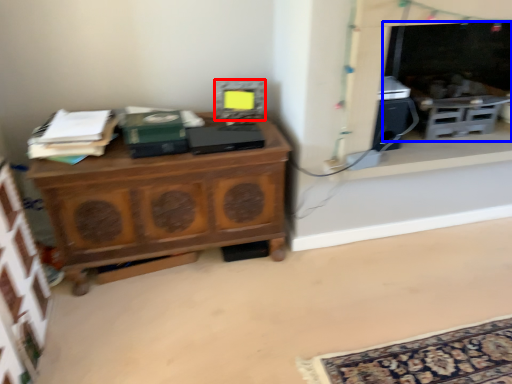
Question: Which object is further to the camera taking this photo, appliance (highlighted by a red box) or fireplace (highlighted by a blue box)?

Choices:
 (A) appliance
 (B) fireplace

Answer: (A)